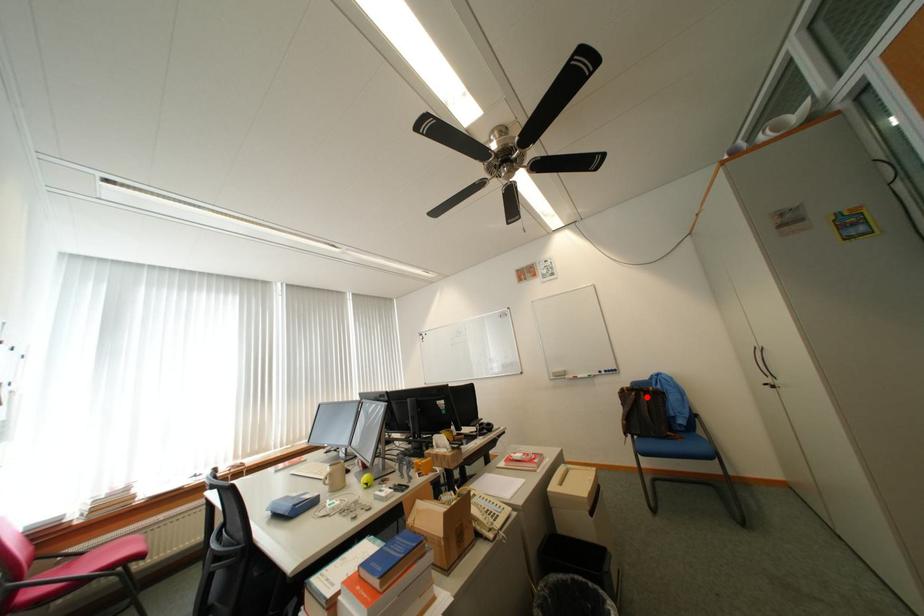
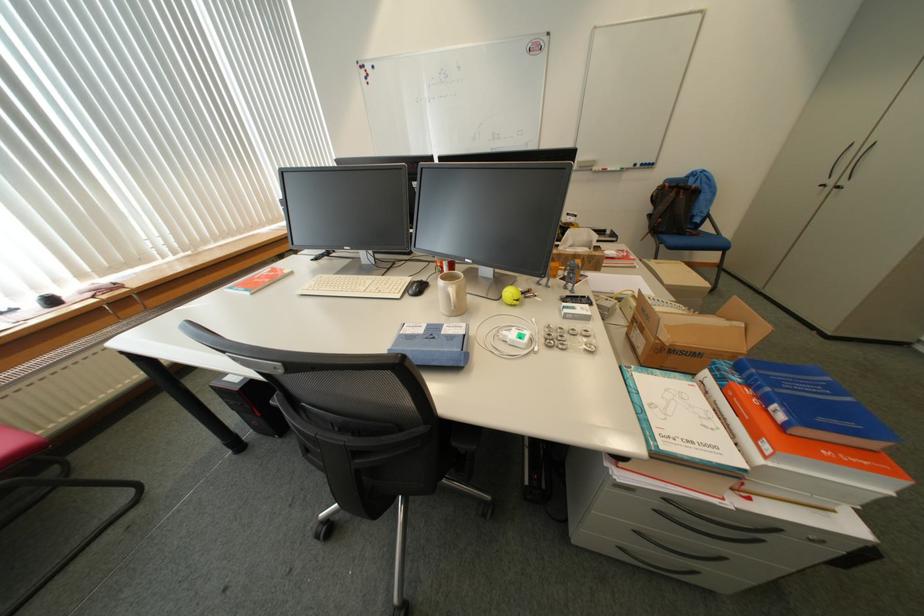
Where in the second image is the point corresponding to the highlighted location from the first image?

(687, 195)